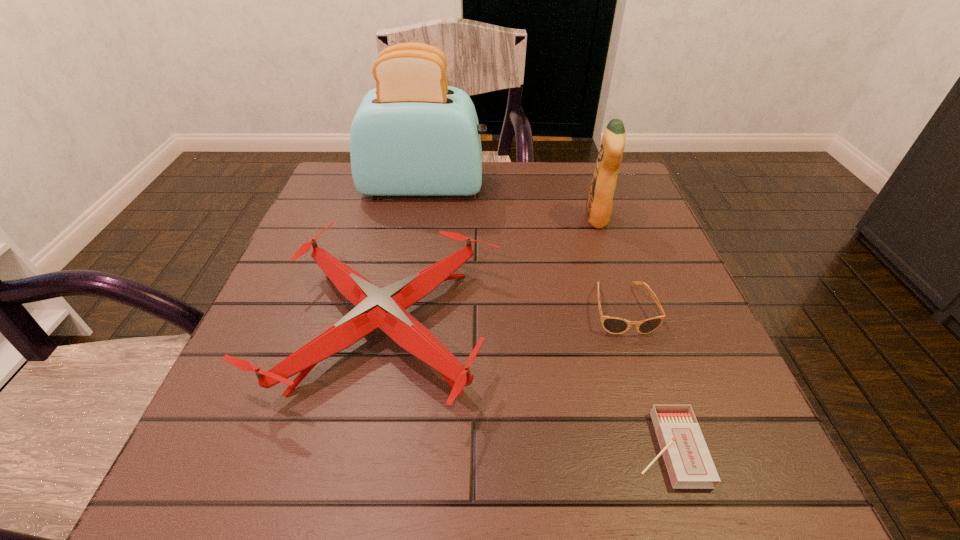
The width and height of the screenshot is (960, 540). In the image, there is a desktop. What are the coordinates of `free space at the far left corner` in the screenshot? It's located at (360, 199).

In the image, there is a desktop. Where is `vacant space at the far right corner`? vacant space at the far right corner is located at coordinates (582, 185).

I want to click on vacant region at the near right corner of the desktop, so [730, 455].

At what (x,y) coordinates should I click in order to perform the action: click on vacant space in between the farthest object and the fourth shortest object. Please return your answer as a coordinate pair (x, y). This screenshot has width=960, height=540. Looking at the image, I should click on (511, 202).

Locate an element on the screen. Image resolution: width=960 pixels, height=540 pixels. free area in between the shortest object and the third shortest object is located at coordinates (526, 388).

This screenshot has width=960, height=540. Identify the location of vacant space that's between the third tallest object and the farthest object. (405, 257).

Find the location of `free space between the fourth nearest object and the third tallest object`. free space between the fourth nearest object and the third tallest object is located at coordinates (492, 273).

Find the location of `empty space between the toaster and the fourth nearest object`. empty space between the toaster and the fourth nearest object is located at coordinates (511, 202).

Locate an element on the screen. Image resolution: width=960 pixels, height=540 pixels. free space between the detergent and the third tallest object is located at coordinates (492, 273).

This screenshot has width=960, height=540. In order to click on blank region between the third tallest object and the farthest object in this screenshot , I will do `click(405, 257)`.